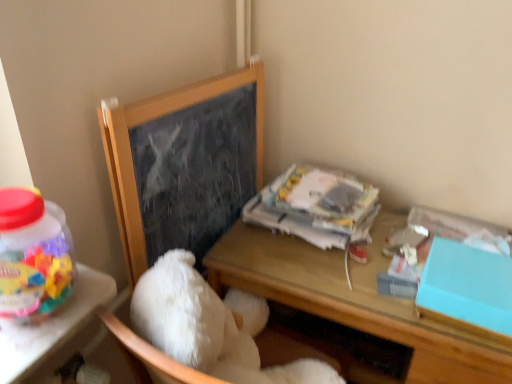
Question: From the image's perspective, is teal matte box at right positioned above or below white paper at upper right?

Choices:
 (A) below
 (B) above

Answer: (A)

Question: Considering their positions, is teal matte box at right located in front of or behind white paper at upper right?

Choices:
 (A) behind
 (B) front

Answer: (B)

Question: Which object is the farthest from the white paper at upper right?

Choices:
 (A) white fluffy teddy bear at center
 (B) wooden chalkboard at upper left
 (C) teal matte box at right
 (D) wooden desk at center

Answer: (A)

Question: Which object is the closest to the teal matte box at right?

Choices:
 (A) wooden desk at center
 (B) wooden chalkboard at upper left
 (C) white paper at upper right
 (D) white fluffy teddy bear at center

Answer: (A)